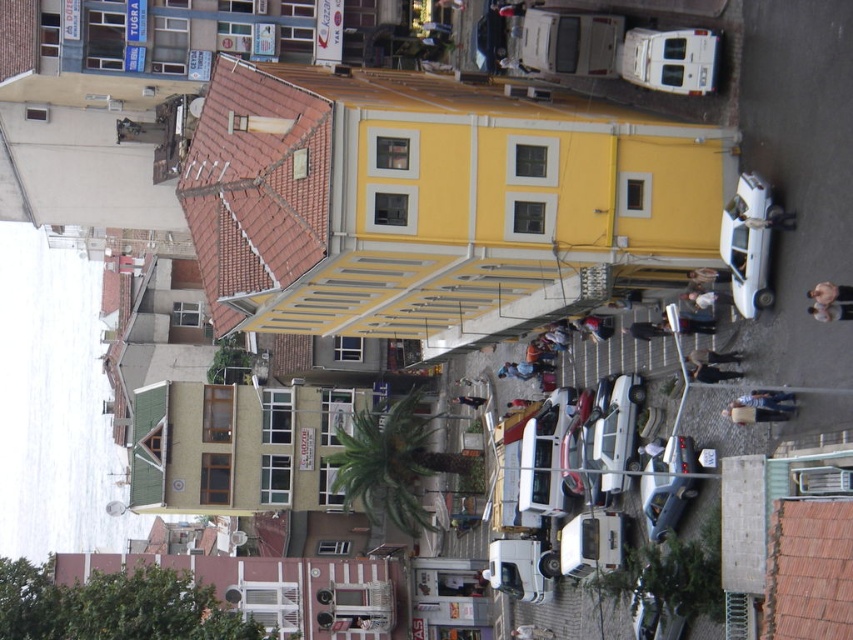
Question: Does white glossy car at right have a lesser width compared to smooth beige doll at center?

Choices:
 (A) no
 (B) yes

Answer: (A)

Question: Which object is farther from the camera taking this photo?

Choices:
 (A) white glossy car at right
 (B) metallic silver car at center

Answer: (B)

Question: Where is metallic silver car at center located in relation to smooth beige doll at center in the image?

Choices:
 (A) above
 (B) below

Answer: (B)

Question: Considering the relative positions of white glossy car at right and denim jacket at lower right in the image provided, where is white glossy car at right located with respect to denim jacket at lower right?

Choices:
 (A) below
 (B) above

Answer: (B)

Question: Which object is positioned closest to the smooth beige doll at center?

Choices:
 (A) light brown leather jacket at center
 (B) blue denim jeans at lower right
 (C) white matte van at center

Answer: (B)

Question: Which point appears farthest from the camera in this image?

Choices:
 (A) (762, 419)
 (B) (834, 284)
 (C) (701, 355)
 (D) (711, 369)

Answer: (C)